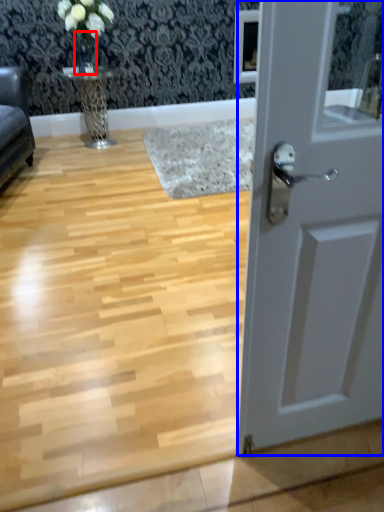
Question: Which point is closer to the camera, glass vase (highlighted by a red box) or door (highlighted by a blue box)?

Choices:
 (A) glass vase
 (B) door

Answer: (B)